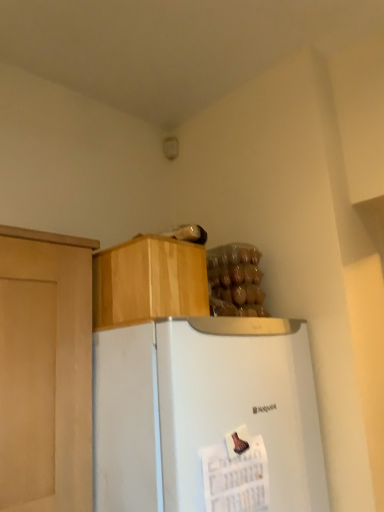
Question: In terms of width, does translucent plastic bag of food at upper right look wider or thinner when compared to wooden cabinet at upper center?

Choices:
 (A) thin
 (B) wide

Answer: (A)

Question: From a real-world perspective, is translucent plastic bag of food at upper right positioned above or below wooden cabinet at upper center?

Choices:
 (A) below
 (B) above

Answer: (B)

Question: Considering the real-world distances, which object is closest to the translucent plastic bag of food at upper right?

Choices:
 (A) wooden cabinet at upper center
 (B) white matte refrigerator at center

Answer: (A)

Question: Which object is the closest to the translucent plastic bag of food at upper right?

Choices:
 (A) white matte refrigerator at center
 (B) wooden cabinet at upper center

Answer: (B)